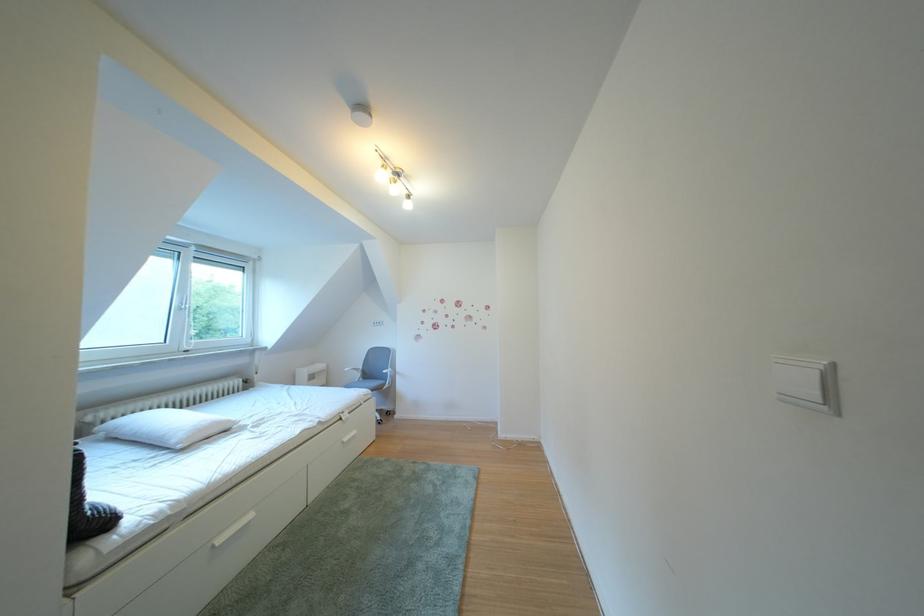
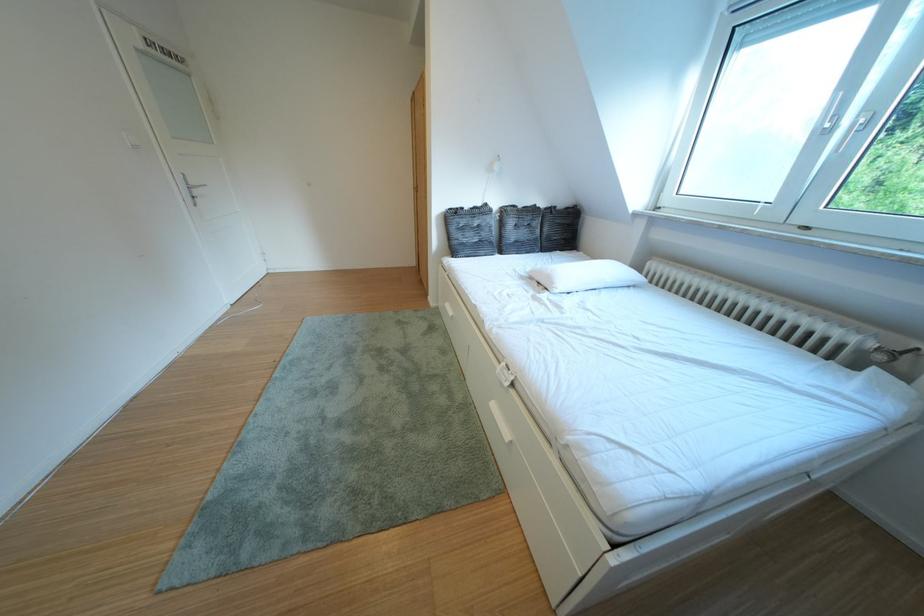
In the second image, find the point that corresponds to [233,546] in the first image.

(460, 310)